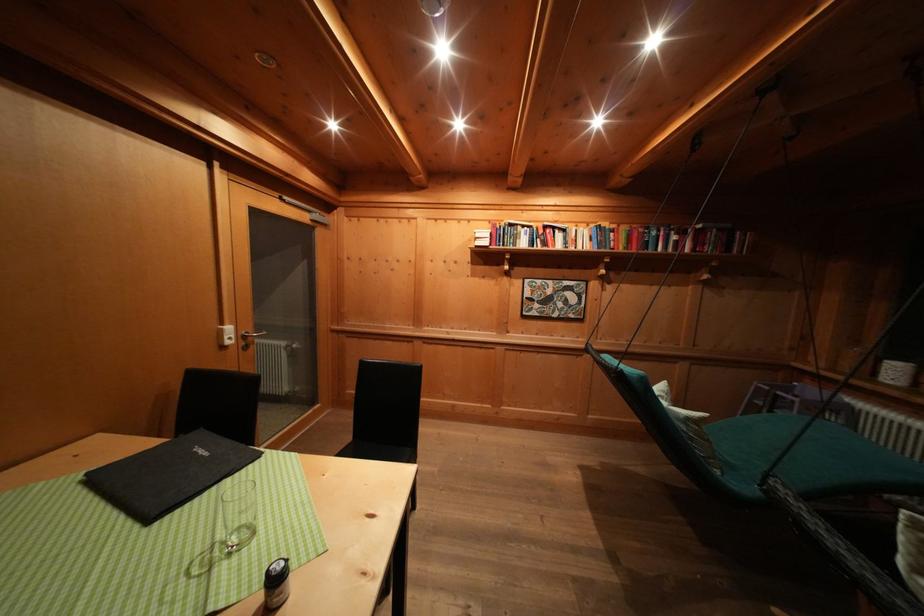
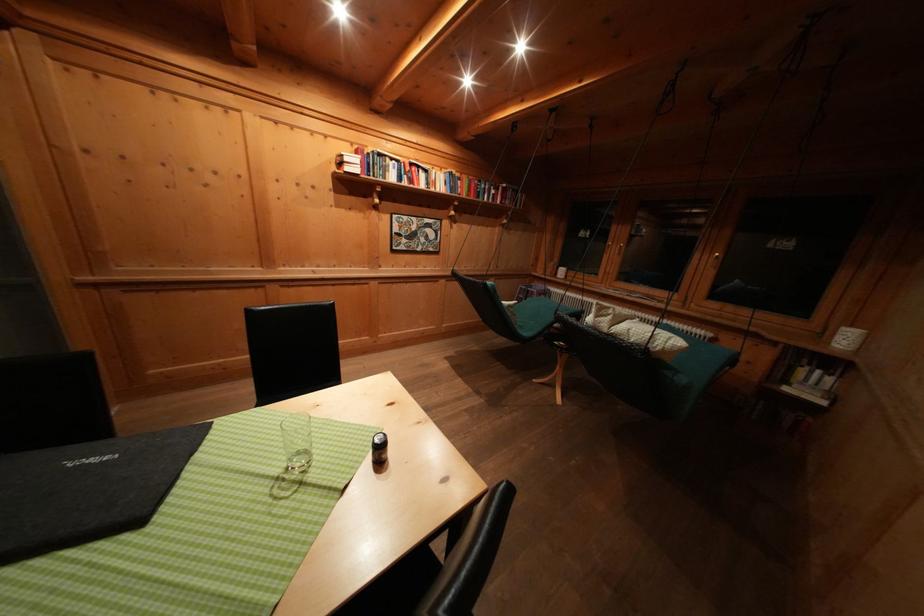
Question: How did the camera likely rotate?

Choices:
 (A) Left
 (B) Right
 (C) Up
 (D) Down

Answer: (B)